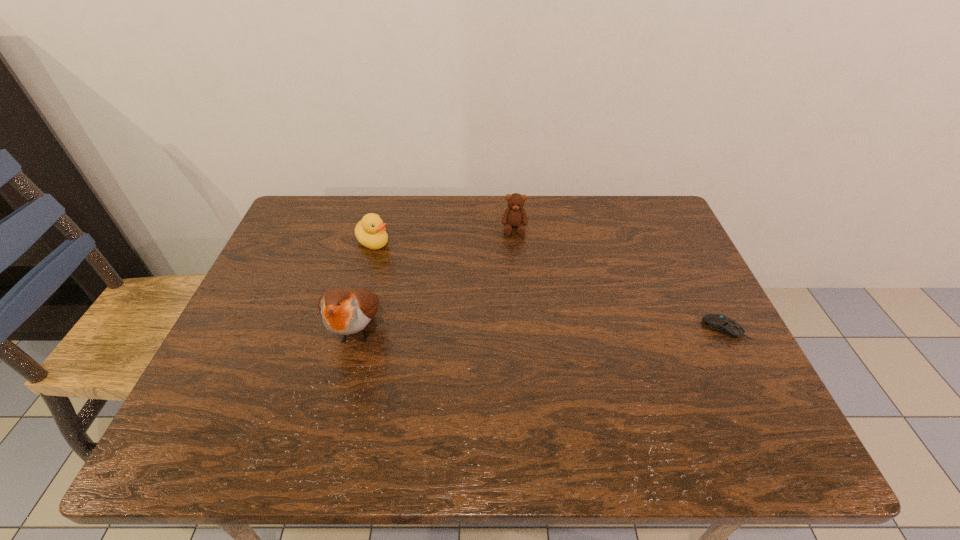
This screenshot has height=540, width=960. In the image, there is a desktop. In order to click on free space at the far right corner in this screenshot , I will do `click(648, 236)`.

Identify the location of vacant space at the near right corner of the desktop. (732, 375).

Locate an element on the screen. vacant area that lies between the teddy bear and the bird is located at coordinates (436, 279).

Find the location of a particular element. free space between the teddy bear and the shortest object is located at coordinates (619, 279).

Locate an element on the screen. vacant space that's between the tallest object and the teddy bear is located at coordinates (436, 279).

You are a GUI agent. You are given a task and a screenshot of the screen. Output one action in this format:
    pyautogui.click(x=<x>, y=<y>)
    Task: Click on the vacant area that lies between the bird and the duckling
    The height and width of the screenshot is (540, 960).
    Given the screenshot: What is the action you would take?
    pyautogui.click(x=366, y=286)

Find the location of a particular element. Image resolution: width=960 pixels, height=540 pixels. vacant area between the shortest object and the duckling is located at coordinates (549, 286).

Where is `blank region between the tallest object and the duckling`? The image size is (960, 540). blank region between the tallest object and the duckling is located at coordinates (366, 286).

I want to click on vacant space that's between the bird and the shortest object, so click(540, 329).

I want to click on free space between the rightmost object and the duckling, so click(x=549, y=286).